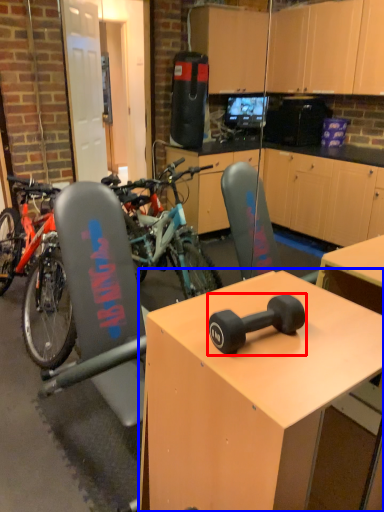
Question: Among these objects, which one is nearest to the camera, dumbbell (highlighted by a red box) or desk (highlighted by a blue box)?

Choices:
 (A) dumbbell
 (B) desk

Answer: (B)